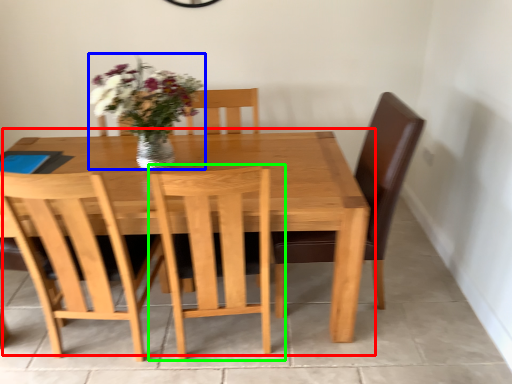
Question: Estimate the real-world distances between objects in this image. Which object is farther from kitchen & dining room table (highlighted by a red box), floral arrangement (highlighted by a blue box) or chair (highlighted by a green box)?

Choices:
 (A) floral arrangement
 (B) chair

Answer: (A)